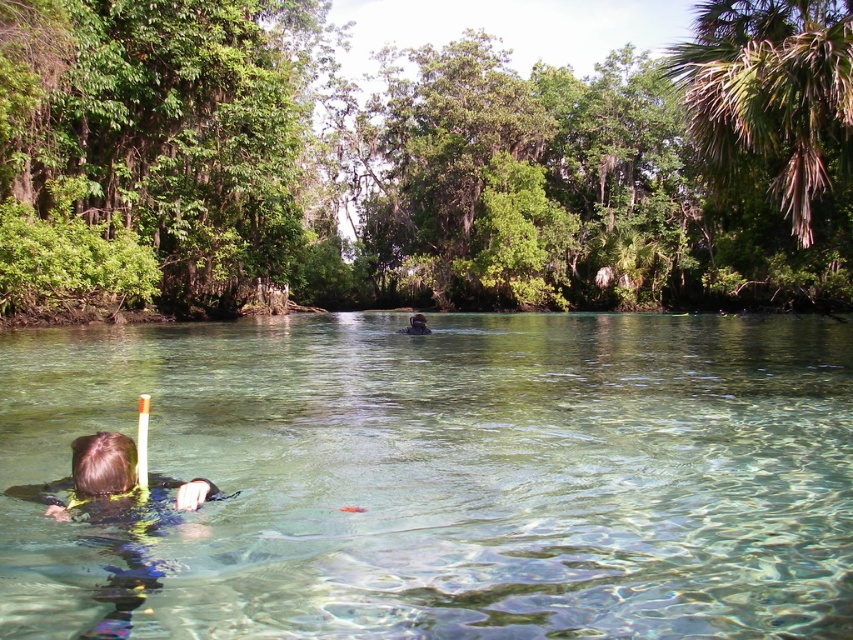
Does blue neoprene snorkeler at lower left have a lesser height compared to yellow-green wetsuit at lower left?

In fact, blue neoprene snorkeler at lower left may be taller than yellow-green wetsuit at lower left.

Consider the image. Does blue neoprene snorkeler at lower left lie behind yellow-green wetsuit at lower left?

No, blue neoprene snorkeler at lower left is in front of yellow-green wetsuit at lower left.

Which is in front, point (48, 493) or point (128, 497)?

Point (128, 497) is in front.

Locate an element on the screen. blue neoprene snorkeler at lower left is located at coordinates (97, 483).

Measure the distance between clear water at center and blue neoprene snorkeler at lower left.

They are 8.01 meters apart.

Which is above, clear water at center or blue neoprene snorkeler at lower left?

clear water at center is above.

The image size is (853, 640). What are the coordinates of `clear water at center` in the screenshot? It's located at (473, 470).

Is yellow-green wetsuit at lower left bigger than black rubber snorkel at center?

Actually, yellow-green wetsuit at lower left might be smaller than black rubber snorkel at center.

Can you confirm if yellow-green wetsuit at lower left is thinner than black rubber snorkel at center?

Correct, yellow-green wetsuit at lower left's width is less than black rubber snorkel at center's.

You are a GUI agent. You are given a task and a screenshot of the screen. Output one action in this format:
    pyautogui.click(x=<x>, y=<y>)
    Task: Click on the yellow-green wetsuit at lower left
    The height and width of the screenshot is (640, 853).
    Given the screenshot: What is the action you would take?
    pyautogui.click(x=96, y=480)